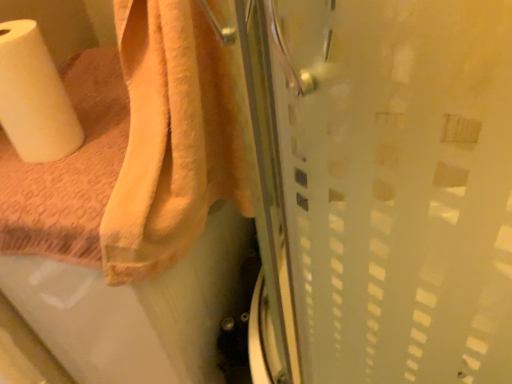
Find the location of a particular element. The image size is (512, 384). vacant region in front of white matte paper towel at left is located at coordinates (55, 172).